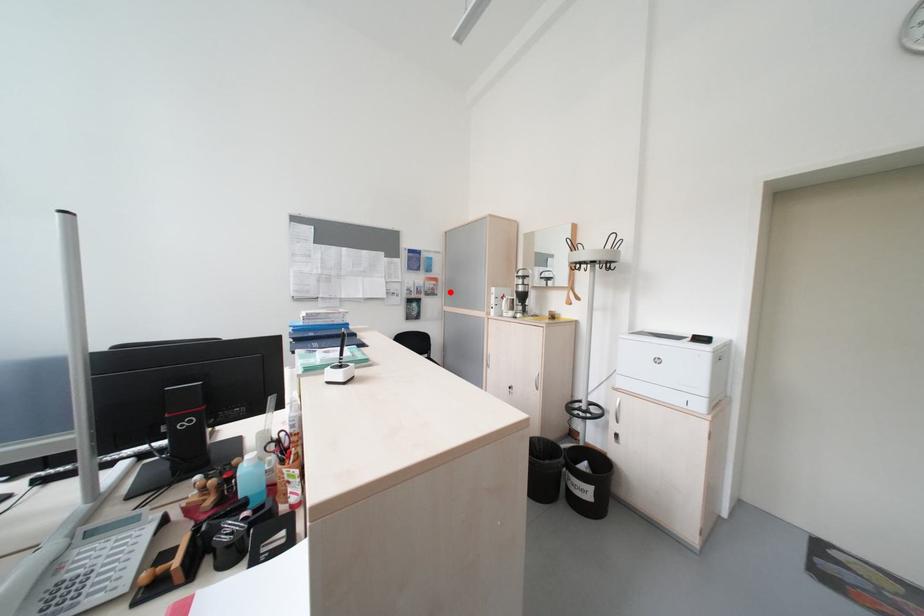
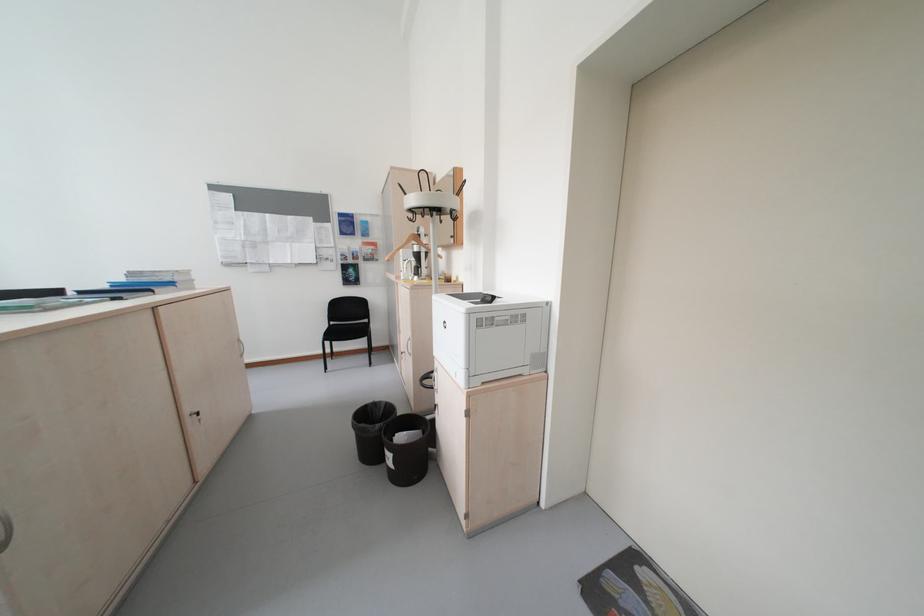
Locate, in the second image, the point that corresponds to the highlighted location in the first image.

(393, 257)